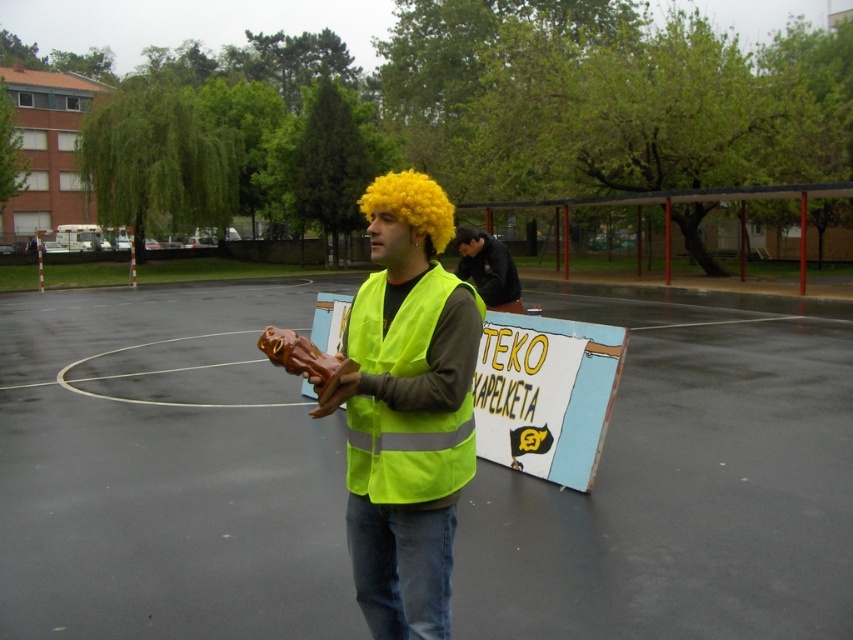
Does neon yellow reflective vest at center have a larger size compared to rubber-like brown hand at center?

Correct, neon yellow reflective vest at center is larger in size than rubber-like brown hand at center.

In the scene shown: Who is more forward, (419, 428) or (308, 378)?

Point (308, 378)

In order to click on neon yellow reflective vest at center in this screenshot , I will do `click(408, 410)`.

Who is positioned more to the left, neon yellow reflective safety vest at center or dark brown leather jacket at center?

neon yellow reflective safety vest at center is more to the left.

Does neon yellow reflective safety vest at center have a lesser width compared to dark brown leather jacket at center?

Yes.

Is point (370, 310) positioned in front of point (461, 269)?

Yes.

Find the location of a particular element. neon yellow reflective safety vest at center is located at coordinates (407, 451).

Is fluffy yellow wig at center to the left of rubber-like brown hand at center from the viewer's perspective?

Correct, you'll find fluffy yellow wig at center to the left of rubber-like brown hand at center.

Is point (438, 188) less distant than point (337, 384)?

No, (438, 188) is behind (337, 384).

At what (x,y) coordinates should I click in order to perform the action: click on fluffy yellow wig at center. Please return your answer as a coordinate pair (x, y). The height and width of the screenshot is (640, 853). Looking at the image, I should click on (410, 205).